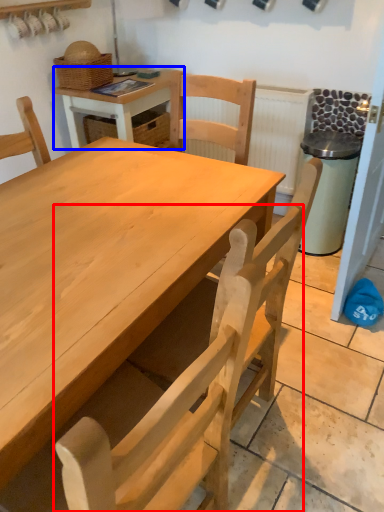
Question: Which object is closer to the camera taking this photo, chair (highlighted by a red box) or table (highlighted by a blue box)?

Choices:
 (A) chair
 (B) table

Answer: (A)